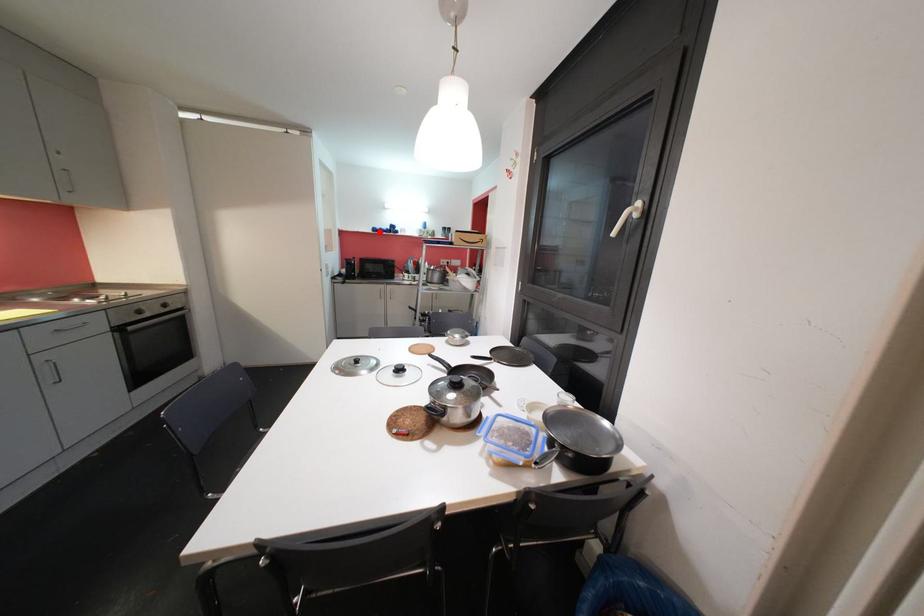
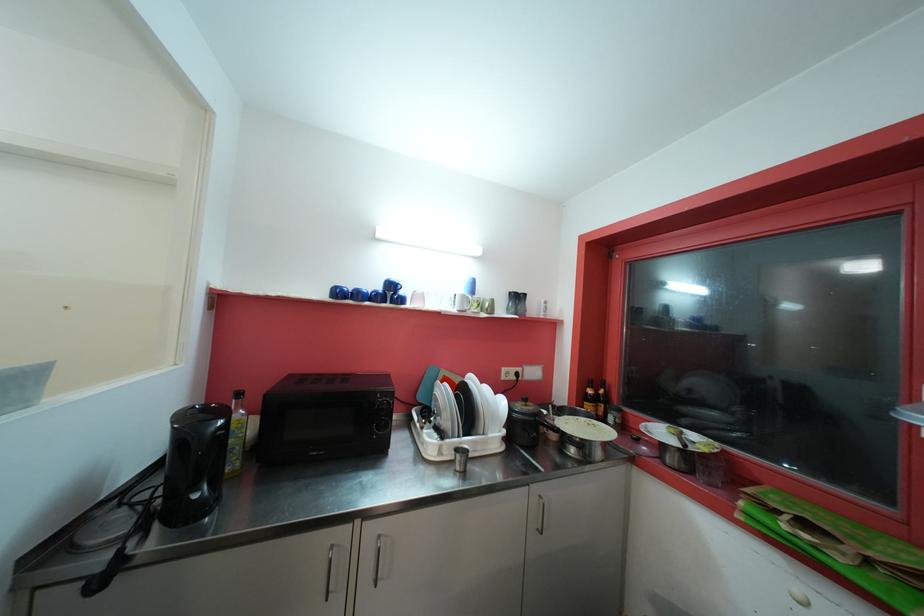
The point at the highlighted location is marked in the first image. Where is the corresponding point in the second image?

(343, 294)